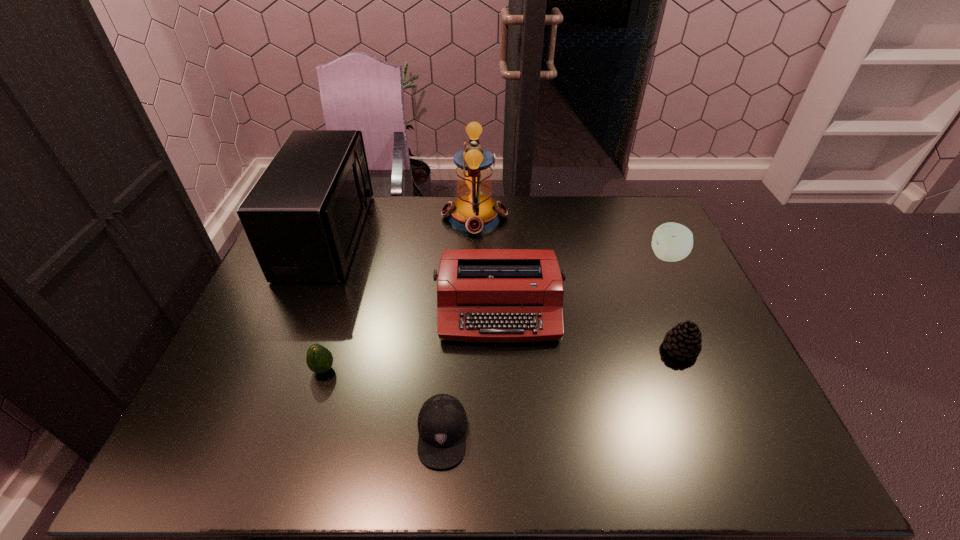
Where is `free location located on the back of the apple`? This screenshot has height=540, width=960. free location located on the back of the apple is located at coordinates (648, 217).

Where is `free space located 0.190m on the typing side of the typewriter`? The width and height of the screenshot is (960, 540). free space located 0.190m on the typing side of the typewriter is located at coordinates (503, 414).

Where is `vacant point located 0.270m at the narrow end of the pinecone`? vacant point located 0.270m at the narrow end of the pinecone is located at coordinates (556, 350).

Where is `free point located 0.220m at the narrow end of the pinecone`? The image size is (960, 540). free point located 0.220m at the narrow end of the pinecone is located at coordinates (576, 350).

I want to click on vacant space situated at the narrow end of the pinecone, so click(525, 350).

Find the location of a particular element. vacant space located on the right of the avocado is located at coordinates (389, 369).

Locate an element on the screen. The image size is (960, 540). lantern at the far edge is located at coordinates (474, 211).

This screenshot has width=960, height=540. I want to click on microwave_oven located in the far edge section of the desktop, so [x=303, y=217].

Where is `object positioned at the near edge`? This screenshot has width=960, height=540. object positioned at the near edge is located at coordinates (442, 422).

The image size is (960, 540). Find the location of `object that is positioned at the left edge`. object that is positioned at the left edge is located at coordinates (303, 217).